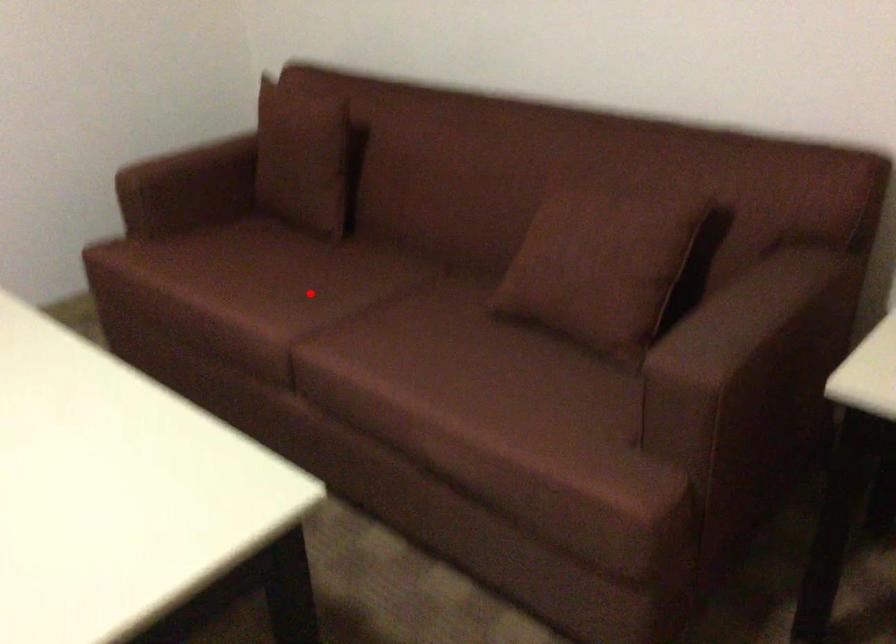
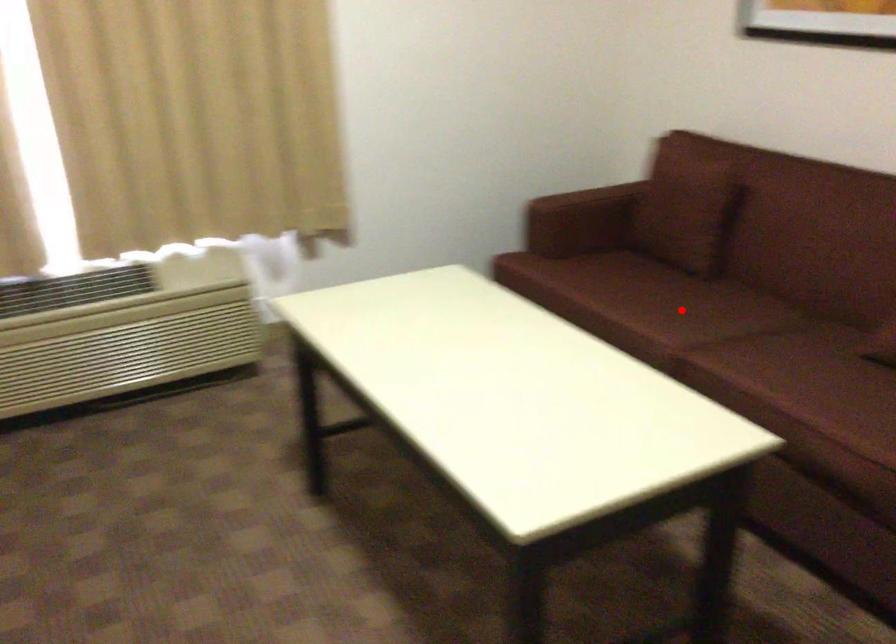
I am providing you with two images of the same scene from different viewpoints. A red point is marked on the first image and another point is marked on the second image. Do the highlighted points in image1 and image2 indicate the same real-world spot?

Yes